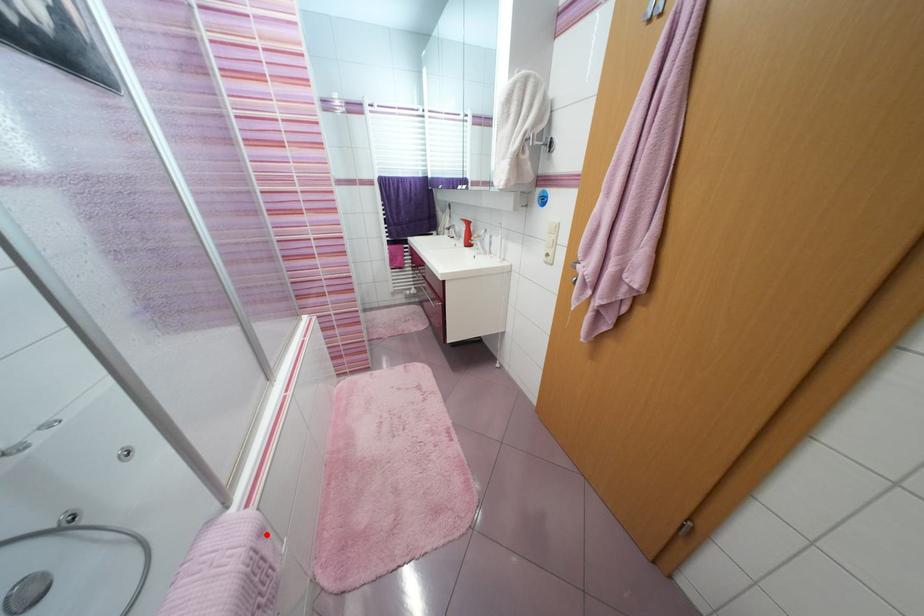
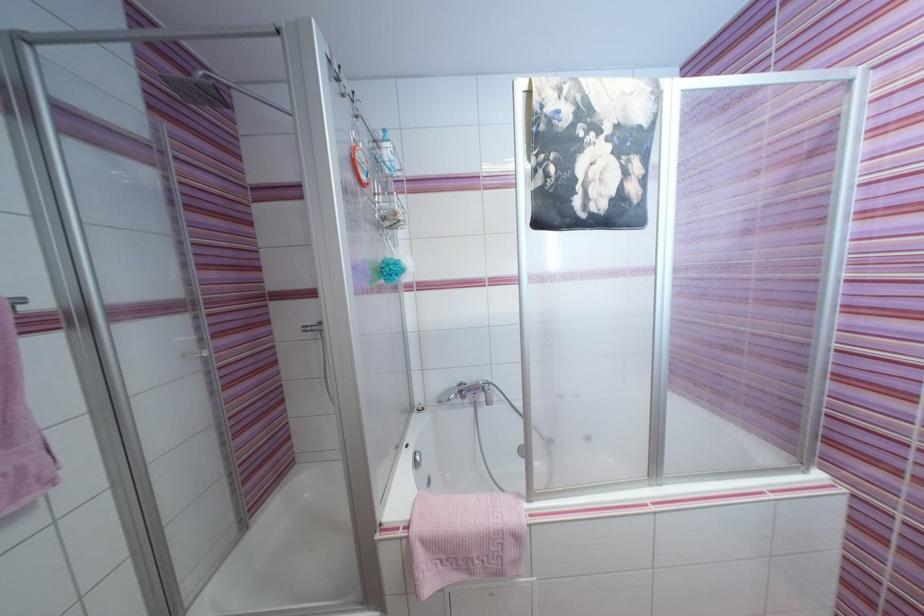
Find the pixel in the second image that matches the highlighted location in the first image.

(521, 539)